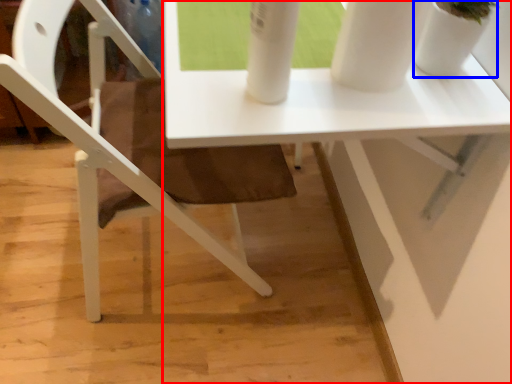
Question: Which point is further to the camera, table (highlighted by a red box) or glass vase (highlighted by a blue box)?

Choices:
 (A) table
 (B) glass vase

Answer: (A)